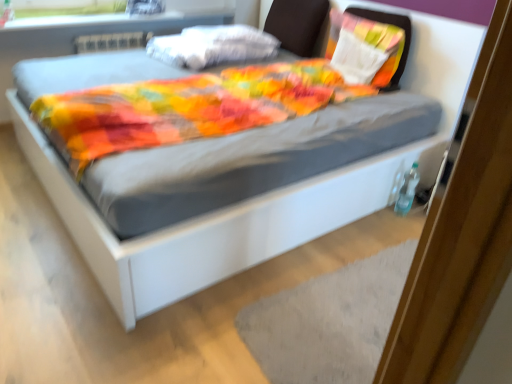
Question: In the image, is gray textured mat at lower center on the left side or the right side of textured fabric pillow at upper right, arranged as the 1th pillow when viewed from the right?

Choices:
 (A) right
 (B) left

Answer: (B)

Question: Would you say gray textured mat at lower center is inside or outside textured fabric pillow at upper right, arranged as the 1th pillow when viewed from the right?

Choices:
 (A) outside
 (B) inside

Answer: (A)

Question: Based on their relative distances, which object is nearer to the brown fabric headboard at upper center?

Choices:
 (A) white cotton pillow at upper center, which is the first pillow in left-to-right order
 (B) gray textured mat at lower center
 (C) matte plastic window sill at upper left
 (D) textured fabric pillow at upper right, arranged as the 1th pillow when viewed from the right

Answer: (A)

Question: Which object is the closest to the matte plastic window sill at upper left?

Choices:
 (A) brown fabric headboard at upper center
 (B) white cotton pillow at upper center, which ranks as the second pillow in right-to-left order
 (C) gray textured mat at lower center
 (D) textured fabric pillow at upper right, arranged as the 1th pillow when viewed from the right

Answer: (B)